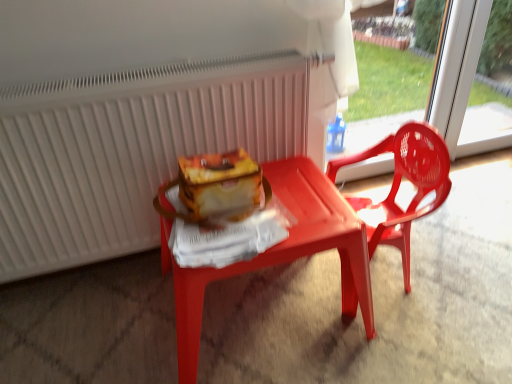
Question: Is white matte radiator at upper center closer to the viewer compared to matte plastic chair at right?

Choices:
 (A) yes
 (B) no

Answer: (A)

Question: From the image's perspective, is white matte radiator at upper center on matte plastic chair at right?

Choices:
 (A) yes
 (B) no

Answer: (A)

Question: Can you confirm if white matte radiator at upper center is taller than matte plastic chair at right?

Choices:
 (A) no
 (B) yes

Answer: (B)

Question: Considering the relative sizes of white matte radiator at upper center and matte plastic chair at right in the image provided, is white matte radiator at upper center bigger than matte plastic chair at right?

Choices:
 (A) yes
 (B) no

Answer: (A)

Question: Is white matte radiator at upper center thinner than matte plastic chair at right?

Choices:
 (A) yes
 (B) no

Answer: (A)

Question: Would you say matte plastic chair at right is part of white matte radiator at upper center's contents?

Choices:
 (A) yes
 (B) no

Answer: (B)

Question: Is matte plastic table at center wider than white matte radiator at upper center?

Choices:
 (A) yes
 (B) no

Answer: (A)

Question: Is matte plastic table at center oriented away from white matte radiator at upper center?

Choices:
 (A) no
 (B) yes

Answer: (B)

Question: Is matte plastic table at center facing towards white matte radiator at upper center?

Choices:
 (A) no
 (B) yes

Answer: (A)

Question: Is matte plastic table at center completely or partially outside of white matte radiator at upper center?

Choices:
 (A) no
 (B) yes

Answer: (B)

Question: Is matte plastic table at center shorter than white matte radiator at upper center?

Choices:
 (A) no
 (B) yes

Answer: (B)

Question: Is matte plastic table at center at the right side of white matte radiator at upper center?

Choices:
 (A) yes
 (B) no

Answer: (A)

Question: Is matte plastic chair at right at the back of matte plastic table at center?

Choices:
 (A) yes
 (B) no

Answer: (B)